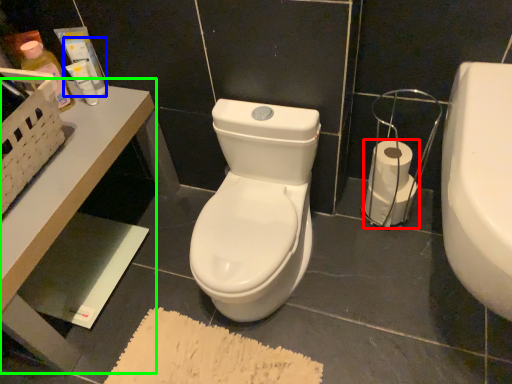
Question: Which object is the closest to the toilet paper (highlighted by a red box)? Choose among these: toiletry (highlighted by a blue box) or table (highlighted by a green box).

Choices:
 (A) toiletry
 (B) table

Answer: (B)